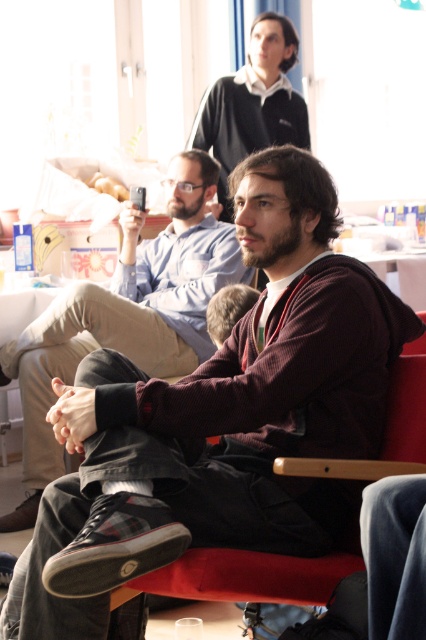
Is dark brown corduroy pants at center to the left of dark blue sweater at upper center from the viewer's perspective?

Correct, you'll find dark brown corduroy pants at center to the left of dark blue sweater at upper center.

Identify the location of dark brown corduroy pants at center. The height and width of the screenshot is (640, 426). (126, 314).

Describe the element at coordinates (126, 314) in the screenshot. I see `dark brown corduroy pants at center` at that location.

What are the coordinates of `dark brown corduroy pants at center` in the screenshot? It's located at (126, 314).

Who is lower down, velvet-like fabric armchair at center or dark blue sweater at upper center?

Positioned lower is velvet-like fabric armchair at center.

Which of these two, velvet-like fabric armchair at center or dark blue sweater at upper center, stands taller?

dark blue sweater at upper center is taller.

Describe the element at coordinates (247, 576) in the screenshot. Image resolution: width=426 pixels, height=640 pixels. I see `velvet-like fabric armchair at center` at that location.

Locate an element on the screen. The height and width of the screenshot is (640, 426). velvet-like fabric armchair at center is located at coordinates (247, 576).

Can you confirm if dark brown corduroy pants at center is positioned above velvet-like fabric armchair at center?

Yes.

Does dark brown corduroy pants at center have a larger size compared to velvet-like fabric armchair at center?

Yes.

Between point (173, 246) and point (167, 593), which one is positioned in front?

Point (167, 593) is in front.

Find the location of `dark brown corduroy pants at center`. dark brown corduroy pants at center is located at coordinates (126, 314).